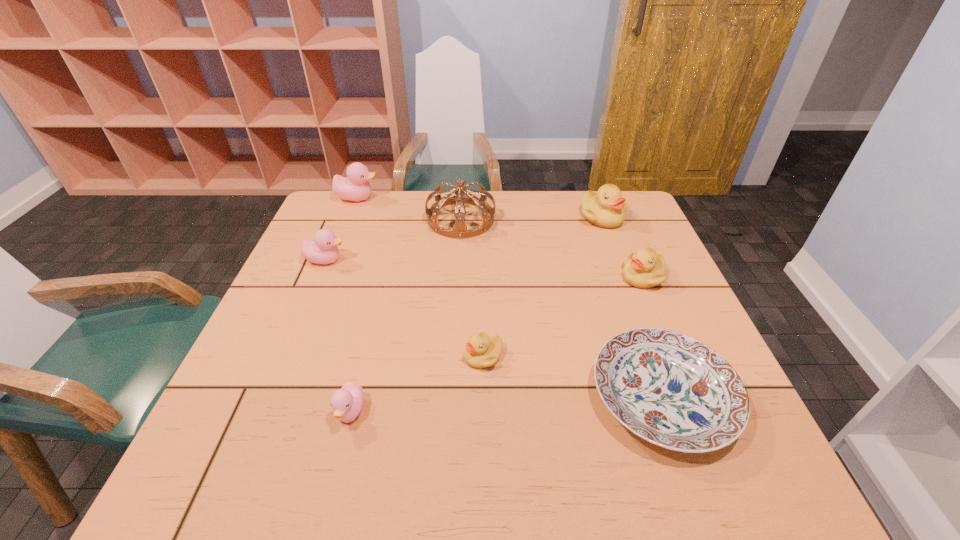
At what (x,y) coordinates should I click in order to perform the action: click on free location located 0.310m on the left of the brown tiara. Please return your answer as a coordinate pair (x, y). Looking at the image, I should click on (327, 220).

You are a GUI agent. You are given a task and a screenshot of the screen. Output one action in this format:
    pyautogui.click(x=<x>, y=<y>)
    Task: Click on the free space located on the front-facing side of the biggest pink duckling
    The image size is (960, 540).
    Given the screenshot: What is the action you would take?
    pyautogui.click(x=476, y=198)

This screenshot has height=540, width=960. In order to click on vacant space located on the front-facing side of the biggest yellow duckling in this screenshot , I will do `click(620, 266)`.

Locate an element on the screen. This screenshot has width=960, height=540. free space located on the front-facing side of the second smallest pink duckling is located at coordinates (492, 260).

The height and width of the screenshot is (540, 960). In order to click on blank space located 0.060m on the front-facing side of the second smallest yellow duckling in this screenshot , I will do `click(599, 277)`.

Locate an element on the screen. free space located 0.080m on the front-facing side of the second smallest yellow duckling is located at coordinates (591, 277).

Where is `vacant space located 0.380m on the front-facing side of the second smallest yellow duckling`? This screenshot has width=960, height=540. vacant space located 0.380m on the front-facing side of the second smallest yellow duckling is located at coordinates (478, 277).

The width and height of the screenshot is (960, 540). Find the location of `free location located 0.110m on the front-facing side of the nearest pink duckling`. free location located 0.110m on the front-facing side of the nearest pink duckling is located at coordinates click(330, 493).

Locate an element on the screen. This screenshot has width=960, height=540. free space located 0.210m on the front-facing side of the fourth duckling from left to right is located at coordinates (369, 356).

Find the location of a particular element. This screenshot has width=960, height=540. free space located on the front-facing side of the fourth duckling from left to right is located at coordinates (305, 356).